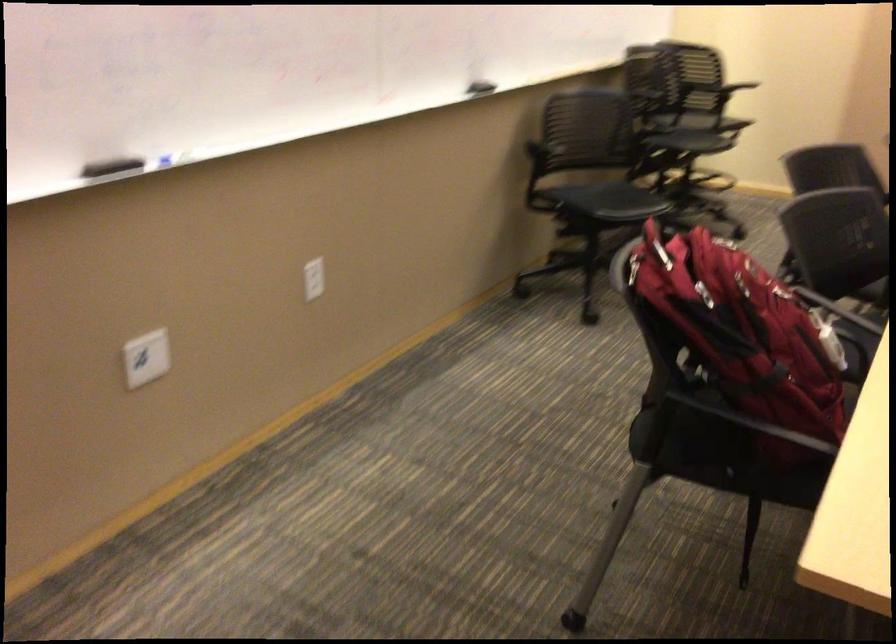
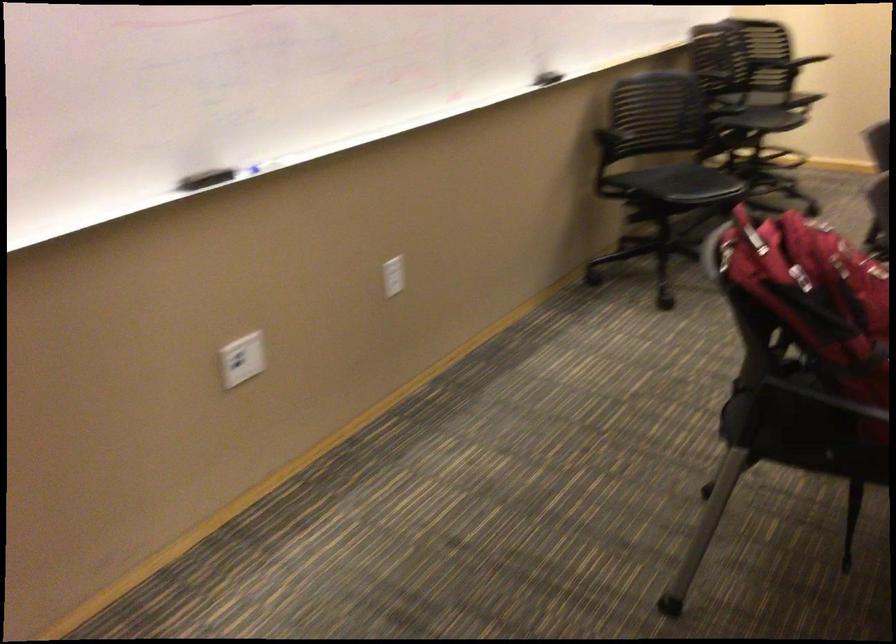
Find the pixel in the second image that matches pixel 117 166 in the first image.

(204, 178)